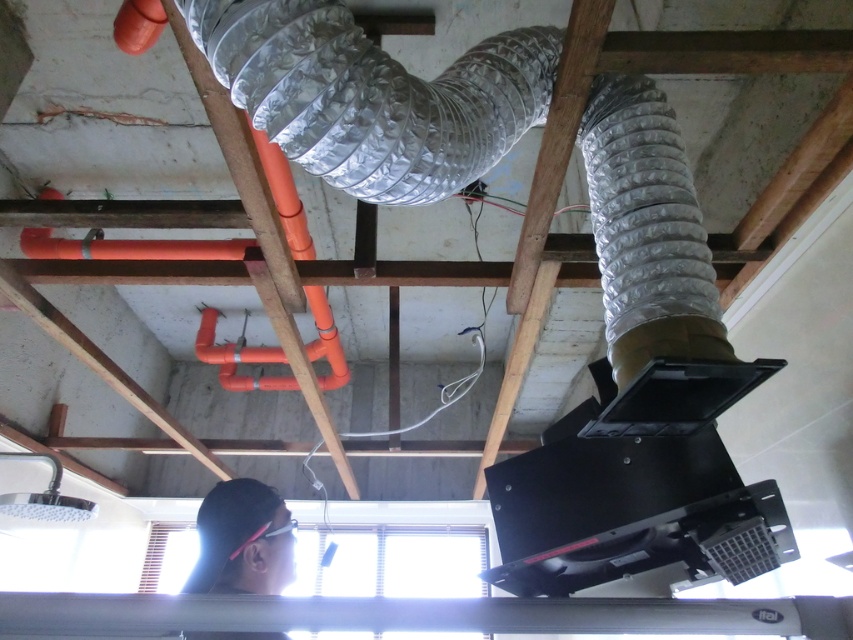
You are a worker in the construction site and you need to hang a 30 inch tool bag between the silver metallic duct at upper center and the black matte hair at lower left. Is there enough space between them to fit the tool bag?

The silver metallic duct at upper center and the black matte hair at lower left are 33.33 inches apart, so yes, the 30 inch tool bag can fit between them since the distance is greater than the tool bag length.

You are a construction worker standing at the center of the room. You need to install a new sensor at the point where the silver metallic duct at upper center is located. According to the coordinates provided, where should you place the sensor?

The silver metallic duct at upper center is located at coordinates point (x=373, y=96), so place the sensor there.